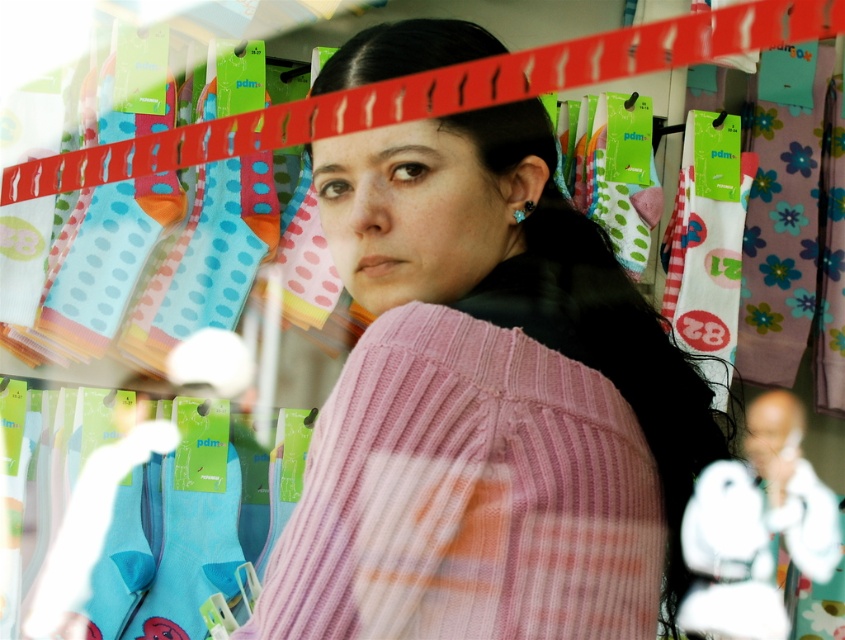
Question: Where is pink ribbed sweater at center located in relation to white plush toy at center in the image?

Choices:
 (A) left
 (B) right

Answer: (A)

Question: Which point appears farthest from the camera in this image?

Choices:
 (A) (767, 605)
 (B) (472, 380)

Answer: (A)

Question: Is pink ribbed sweater at center in front of white plush toy at center?

Choices:
 (A) yes
 (B) no

Answer: (A)

Question: Can you confirm if pink ribbed sweater at center is smaller than white plush toy at center?

Choices:
 (A) yes
 (B) no

Answer: (B)